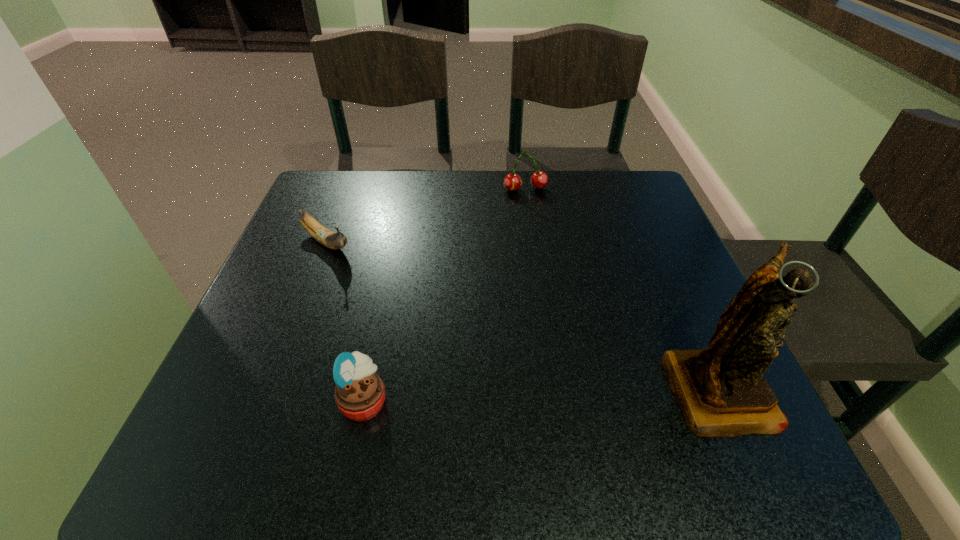
Image resolution: width=960 pixels, height=540 pixels. I want to click on vacant space at the far edge of the desktop, so click(x=427, y=200).

The image size is (960, 540). In the image, there is a desktop. What are the coordinates of `vacant space at the near edge` in the screenshot? It's located at (401, 403).

In the image, there is a desktop. Identify the location of vacant space at the left edge. (276, 265).

In the image, there is a desktop. At what (x,y) coordinates should I click in order to perform the action: click on vacant space at the right edge. Please return your answer as a coordinate pair (x, y). This screenshot has height=540, width=960. Looking at the image, I should click on [x=688, y=313].

In the image, there is a desktop. Where is `vacant space at the near left corner`? This screenshot has width=960, height=540. vacant space at the near left corner is located at coordinates (279, 387).

This screenshot has height=540, width=960. In the image, there is a desktop. Identify the location of free space at the far right corner. (607, 195).

You are a GUI agent. You are given a task and a screenshot of the screen. Output one action in this format:
    pyautogui.click(x=<x>, y=<y>)
    Task: Click on the vacant space in between the figurine and the leftmost object
    Image resolution: width=960 pixels, height=540 pixels.
    Given the screenshot: What is the action you would take?
    pyautogui.click(x=522, y=315)

I want to click on vacant space that's between the rightmost object and the third object from left to right, so click(x=622, y=288).

Identify the location of free space that is in between the leftmost object and the muffin. This screenshot has height=540, width=960. (345, 322).

The height and width of the screenshot is (540, 960). What are the coordinates of `empty space between the tallest object and the banana` in the screenshot? It's located at [522, 315].